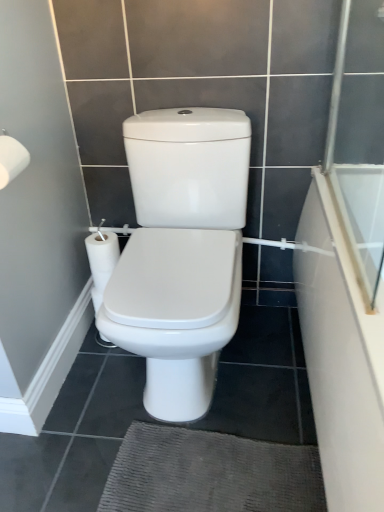
Question: Does white glossy bathtub at right appear on the left side of white matte toilet paper at upper left?

Choices:
 (A) no
 (B) yes

Answer: (A)

Question: Is white glossy bathtub at right at the right side of white matte toilet paper at upper left?

Choices:
 (A) yes
 (B) no

Answer: (A)

Question: Is white glossy bathtub at right wider than white matte toilet paper at upper left?

Choices:
 (A) yes
 (B) no

Answer: (A)

Question: Can you confirm if white glossy bathtub at right is thinner than white matte toilet paper at upper left?

Choices:
 (A) yes
 (B) no

Answer: (B)

Question: Does white glossy bathtub at right turn towards white matte toilet paper at upper left?

Choices:
 (A) no
 (B) yes

Answer: (A)

Question: From the image's perspective, is white glossy bathtub at right positioned above or below white matte toilet paper at upper left?

Choices:
 (A) below
 (B) above

Answer: (A)

Question: Considering the positions of white glossy bathtub at right and white matte toilet paper at upper left in the image, is white glossy bathtub at right wider or thinner than white matte toilet paper at upper left?

Choices:
 (A) wide
 (B) thin

Answer: (A)

Question: Looking at the image, does white glossy bathtub at right seem bigger or smaller compared to white matte toilet paper at upper left?

Choices:
 (A) big
 (B) small

Answer: (A)

Question: In terms of height, does white glossy bathtub at right look taller or shorter compared to white matte toilet paper at upper left?

Choices:
 (A) tall
 (B) short

Answer: (A)

Question: Looking at their shapes, would you say white matte toilet paper at upper left is wider or thinner than transparent glass screen door at right?

Choices:
 (A) wide
 (B) thin

Answer: (A)

Question: Would you say white matte toilet paper at upper left is inside or outside transparent glass screen door at right?

Choices:
 (A) inside
 (B) outside

Answer: (B)

Question: From a real-world perspective, relative to transparent glass screen door at right, is white matte toilet paper at upper left vertically above or below?

Choices:
 (A) below
 (B) above

Answer: (A)

Question: In the image, is white matte toilet paper at upper left positioned in front of or behind transparent glass screen door at right?

Choices:
 (A) front
 (B) behind

Answer: (B)

Question: From the image's perspective, is transparent glass screen door at right positioned above or below white glossy bathtub at right?

Choices:
 (A) above
 (B) below

Answer: (A)

Question: Does point (372, 115) appear closer or farther from the camera than point (322, 306)?

Choices:
 (A) farther
 (B) closer

Answer: (A)